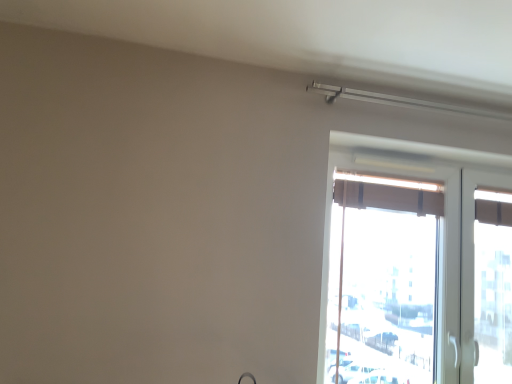
The height and width of the screenshot is (384, 512). Identify the location of matte brown curtain at right. (416, 264).

What do you see at coordinates (416, 264) in the screenshot?
I see `matte brown curtain at right` at bounding box center [416, 264].

The height and width of the screenshot is (384, 512). I want to click on brown fabric curtain at upper right, so click(x=388, y=197).

What do you see at coordinates (388, 197) in the screenshot?
I see `brown fabric curtain at upper right` at bounding box center [388, 197].

Where is `matte brown curtain at right`? matte brown curtain at right is located at coordinates (416, 264).

Considering the relative positions of matte brown curtain at right and brown fabric curtain at upper right in the image provided, is matte brown curtain at right to the right of brown fabric curtain at upper right from the viewer's perspective?

Indeed, matte brown curtain at right is positioned on the right side of brown fabric curtain at upper right.

Based on the photo, is matte brown curtain at right positioned behind brown fabric curtain at upper right?

No, it is in front of brown fabric curtain at upper right.

Considering the points (462, 230) and (342, 203), which point is behind, point (462, 230) or point (342, 203)?

Positioned behind is point (462, 230).

From the image's perspective, does matte brown curtain at right appear higher than brown fabric curtain at upper right?

No, from the image's perspective, matte brown curtain at right is not on top of brown fabric curtain at upper right.

From a real-world perspective, is matte brown curtain at right under brown fabric curtain at upper right?

Yes.

Is matte brown curtain at right wider or thinner than brown fabric curtain at upper right?

matte brown curtain at right is wider than brown fabric curtain at upper right.

Considering the relative sizes of matte brown curtain at right and brown fabric curtain at upper right in the image provided, is matte brown curtain at right taller than brown fabric curtain at upper right?

Yes, matte brown curtain at right is taller than brown fabric curtain at upper right.

Does matte brown curtain at right have a larger size compared to brown fabric curtain at upper right?

Indeed, matte brown curtain at right has a larger size compared to brown fabric curtain at upper right.

Is brown fabric curtain at upper right a part of matte brown curtain at right?

Absolutely, brown fabric curtain at upper right is inside matte brown curtain at right.

Looking at this image, is the surface of matte brown curtain at right in direct contact with brown fabric curtain at upper right?

No, matte brown curtain at right is not beside brown fabric curtain at upper right.

Is matte brown curtain at right turned away from brown fabric curtain at upper right?

Yes, brown fabric curtain at upper right is at the back of matte brown curtain at right.

How distant is matte brown curtain at right from brown fabric curtain at upper right?

A distance of 24.76 centimeters exists between matte brown curtain at right and brown fabric curtain at upper right.

The image size is (512, 384). Identify the location of curtain that appears above the matte brown curtain at right (from a real-world perspective). (388, 197).

Which object is positioned more to the right, brown fabric curtain at upper right or matte brown curtain at right?

From the viewer's perspective, matte brown curtain at right appears more on the right side.

Which is behind, brown fabric curtain at upper right or matte brown curtain at right?

brown fabric curtain at upper right is further from the camera.

Considering the positions of points (339, 200) and (416, 287), is point (339, 200) farther from camera compared to point (416, 287)?

Yes, it is behind point (416, 287).

From the image's perspective, between brown fabric curtain at upper right and matte brown curtain at right, who is located below?

From the image's view, matte brown curtain at right is below.

From a real-world perspective, is brown fabric curtain at upper right physically above matte brown curtain at right?

Yes, from a real-world perspective, brown fabric curtain at upper right is on top of matte brown curtain at right.

Which of these two, brown fabric curtain at upper right or matte brown curtain at right, is wider?

matte brown curtain at right is wider.

In the scene shown: Considering the sizes of brown fabric curtain at upper right and matte brown curtain at right in the image, is brown fabric curtain at upper right taller or shorter than matte brown curtain at right?

Considering their sizes, brown fabric curtain at upper right has less height than matte brown curtain at right.

Based on their sizes in the image, would you say brown fabric curtain at upper right is bigger or smaller than matte brown curtain at right?

Considering their sizes, brown fabric curtain at upper right takes up less space than matte brown curtain at right.

Is brown fabric curtain at upper right inside or outside of matte brown curtain at right?

brown fabric curtain at upper right is enclosed within matte brown curtain at right.

Is brown fabric curtain at upper right beside matte brown curtain at right?

No, brown fabric curtain at upper right is not touching matte brown curtain at right.

Does brown fabric curtain at upper right turn towards matte brown curtain at right?

Yes, brown fabric curtain at upper right is aimed at matte brown curtain at right.

How many degrees apart are the facing directions of brown fabric curtain at upper right and matte brown curtain at right?

0.000641 degrees separate the facing orientations of brown fabric curtain at upper right and matte brown curtain at right.

Where is `window on the right side of brown fabric curtain at upper right`? The width and height of the screenshot is (512, 384). window on the right side of brown fabric curtain at upper right is located at coordinates (416, 264).

You are a GUI agent. You are given a task and a screenshot of the screen. Output one action in this format:
    pyautogui.click(x=<x>, y=<y>)
    Task: Click on the curtain that appears behind the matte brown curtain at right
    
    Given the screenshot: What is the action you would take?
    pyautogui.click(x=388, y=197)

The width and height of the screenshot is (512, 384). I want to click on window that appears in front of the brown fabric curtain at upper right, so click(416, 264).